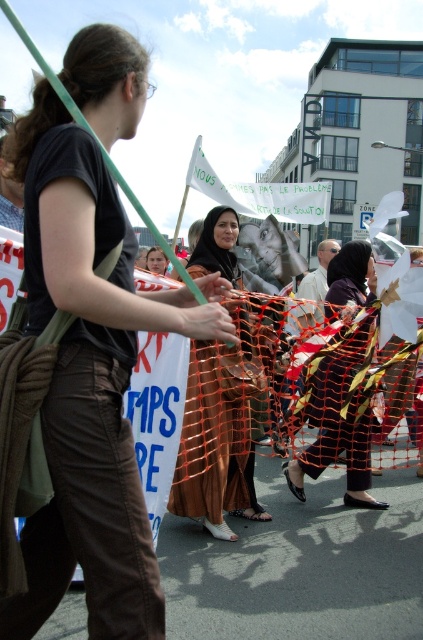
You are a photographer at the protest scene. You want to capture a photo that includes both the brown cotton pants at left and the brown satin dress at center. Based on their positions, which one should you focus on first to ensure both are in the frame?

The brown cotton pants at left is in front of the brown satin dress at center, so you should focus on the brown cotton pants at left first to ensure both are in the frame.

You are a photographer at the protest event. You need to capture a photo that highlights both the brown satin dress at center and the black fabric hijab at center. Which object should you focus on to ensure both are visible without cropping?

You should focus on the black fabric hijab at center since it occupies more space than the brown satin dress at center, allowing both to be visible without cropping.

You are a photographer trying to capture the protest scene. You notice two points marked in the image. The first point is at coordinates point (211,256) and the second is at point (307,464). Which point is closer to the camera?

Point (211,256) is in front of point (307,464), so the first point is closer to the camera.